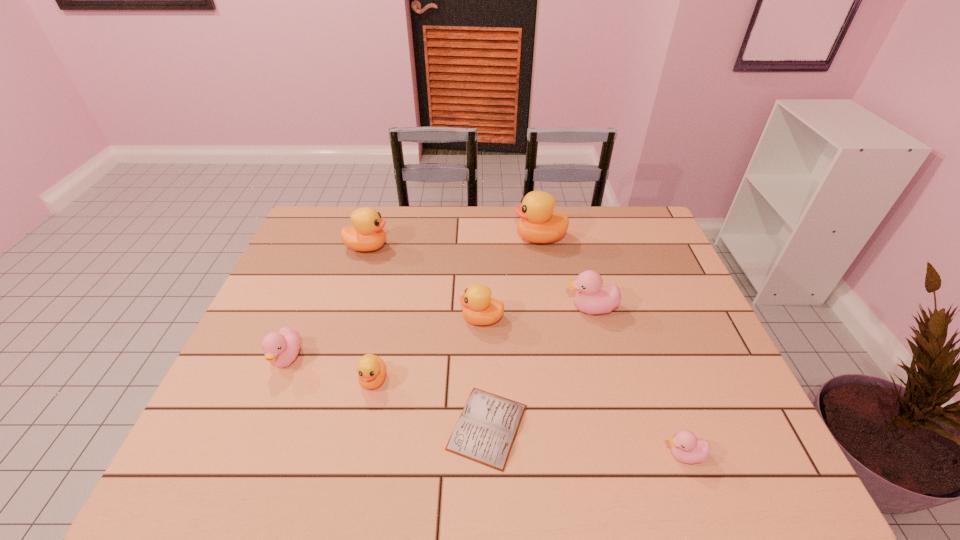
The image size is (960, 540). In order to click on free space at the far left corner of the desktop in this screenshot , I will do `click(308, 243)`.

Where is `free space between the second biggest pink duckling and the biggest pink duckling`? The width and height of the screenshot is (960, 540). free space between the second biggest pink duckling and the biggest pink duckling is located at coordinates (439, 334).

Where is `vacant point located between the biggest pink duckling and the leftmost pink duckling`? This screenshot has height=540, width=960. vacant point located between the biggest pink duckling and the leftmost pink duckling is located at coordinates (439, 334).

Where is `free spot between the fifth duckling from right to left and the leftmost yellow duckling`? This screenshot has width=960, height=540. free spot between the fifth duckling from right to left and the leftmost yellow duckling is located at coordinates [x=371, y=313].

Where is `free area in between the farthest pink duckling and the nearest pink duckling`? Image resolution: width=960 pixels, height=540 pixels. free area in between the farthest pink duckling and the nearest pink duckling is located at coordinates (637, 382).

Where is `free space between the second biggest yellow duckling and the tallest object`? free space between the second biggest yellow duckling and the tallest object is located at coordinates (453, 242).

Where is `empty location between the shortest object and the third object from left to right`? This screenshot has width=960, height=540. empty location between the shortest object and the third object from left to right is located at coordinates (430, 403).

Where is `vacant space that is in between the fourth duckling from right to left and the farthest pink duckling`? This screenshot has height=540, width=960. vacant space that is in between the fourth duckling from right to left and the farthest pink duckling is located at coordinates (537, 314).

You are a GUI agent. You are given a task and a screenshot of the screen. Output one action in this format:
    pyautogui.click(x=<x>, y=<y>)
    Task: Click on the vacant space that's between the leftmost pink duckling and the rightmost yellow duckling
    The width and height of the screenshot is (960, 540).
    Given the screenshot: What is the action you would take?
    pyautogui.click(x=413, y=298)

At what (x,y) coordinates should I click in order to perform the action: click on free spot between the white diary and the second biggest pink duckling. Please return your answer as a coordinate pair (x, y). The height and width of the screenshot is (540, 960). Looking at the image, I should click on (387, 393).